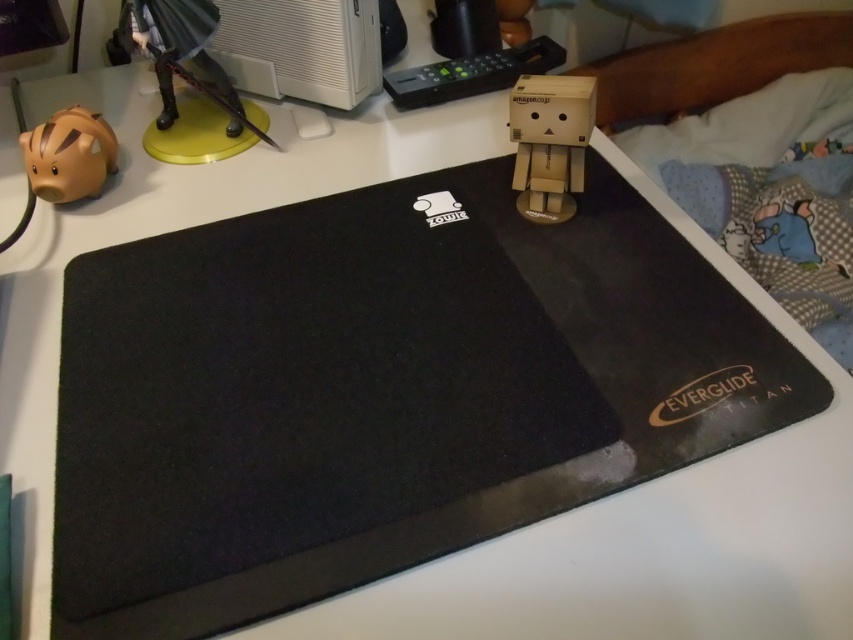
Question: Which point is farther from the camera taking this photo?

Choices:
 (A) (80, 140)
 (B) (514, 99)

Answer: (A)

Question: Is cardboard figure at center above matte brown piggy bank at left?

Choices:
 (A) yes
 (B) no

Answer: (A)

Question: Does black fabric bed at upper right have a lesser width compared to yellow plastic figurine at upper left?

Choices:
 (A) no
 (B) yes

Answer: (A)

Question: Which point is farther to the camera?

Choices:
 (A) black fabric bed at upper right
 (B) matte brown piggy bank at left
 (C) yellow plastic figurine at upper left

Answer: (A)

Question: Considering the relative positions of black fabric bed at upper right and yellow plastic figurine at upper left in the image provided, where is black fabric bed at upper right located with respect to yellow plastic figurine at upper left?

Choices:
 (A) right
 (B) left

Answer: (A)

Question: Which point is closer to the camera?

Choices:
 (A) coord(828,60)
 (B) coord(90,170)

Answer: (B)